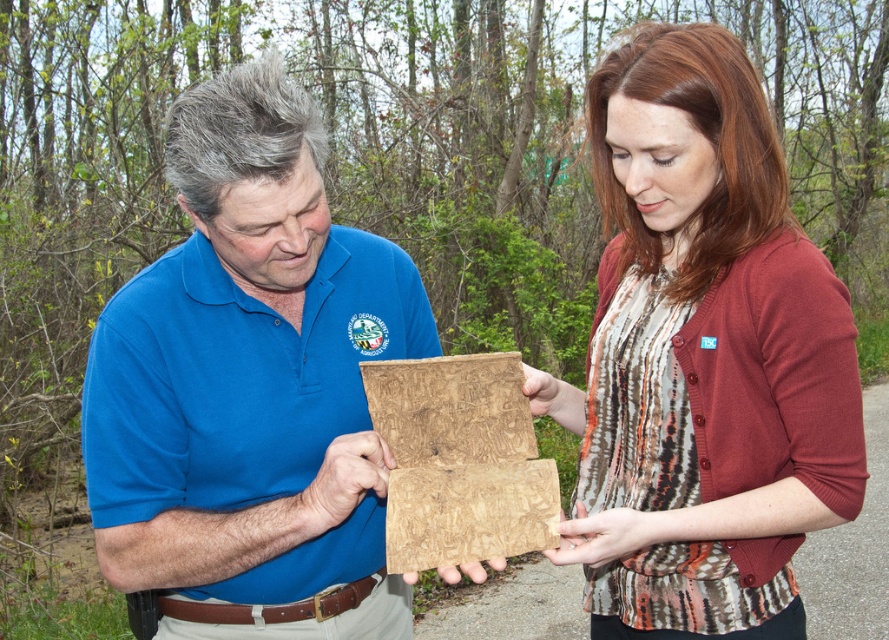
Can you confirm if matte wood board at center is smaller than matte brown wood at center?

Yes, matte wood board at center is smaller than matte brown wood at center.

Between matte wood board at center and matte brown wood at center, which one is positioned lower?

Positioned lower is matte wood board at center.

Is point (343, 600) less distant than point (743, 572)?

No, it is behind (743, 572).

Identify the location of matte wood board at center. This screenshot has width=889, height=640. (251, 387).

Which is more to the right, matte brown wood at center or wooden board at center?

Positioned to the right is matte brown wood at center.

The image size is (889, 640). Describe the element at coordinates (702, 356) in the screenshot. I see `matte brown wood at center` at that location.

Where is `matte brown wood at center`? The width and height of the screenshot is (889, 640). matte brown wood at center is located at coordinates (702, 356).

Can you confirm if matte wood board at center is bigger than wooden board at center?

Yes.

Which is below, matte wood board at center or wooden board at center?

Positioned lower is wooden board at center.

Is point (189, 595) closer to viewer compared to point (455, 380)?

No, (189, 595) is behind (455, 380).

In order to click on matte wood board at center in this screenshot , I will do `click(251, 387)`.